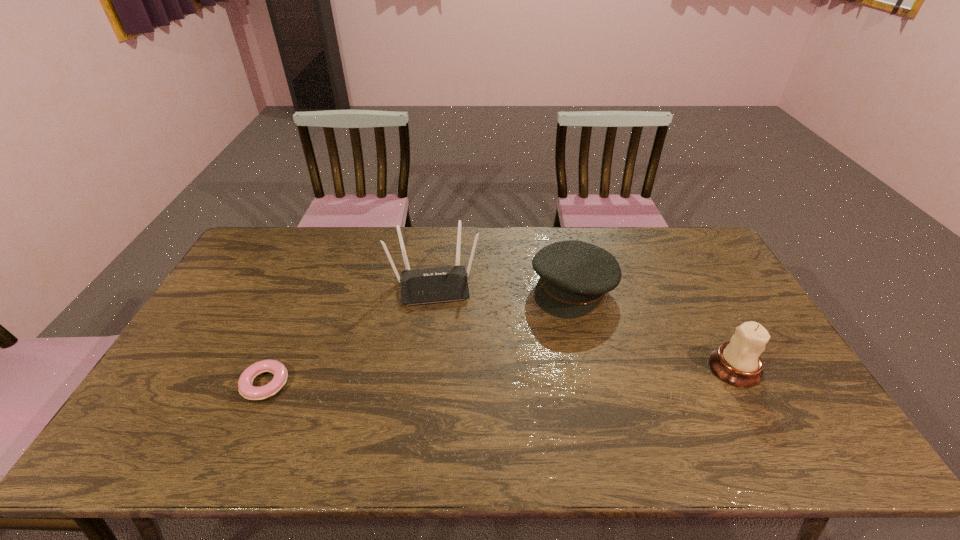
Identify the location of vacant space located on the front-facing side of the second object from right to left. (534, 332).

I want to click on free space located 0.370m on the front-facing side of the second object from left to right, so click(x=447, y=413).

The height and width of the screenshot is (540, 960). What are the coordinates of `vacant region located 0.210m on the front-facing side of the second object from left to right` in the screenshot? It's located at (443, 362).

Find the location of a particular element. This screenshot has width=960, height=540. blank space located 0.140m on the front-facing side of the second object from left to right is located at coordinates (441, 342).

You are a GUI agent. You are given a task and a screenshot of the screen. Output one action in this format:
    pyautogui.click(x=<x>, y=<y>)
    Task: Click on the beret present at the far edge
    This screenshot has height=540, width=960.
    Given the screenshot: What is the action you would take?
    pyautogui.click(x=574, y=275)

Locate an element on the screen. The height and width of the screenshot is (540, 960). router at the far edge is located at coordinates (430, 285).

I want to click on object present at the near edge, so click(246, 389).

What are the coordinates of `object at the right edge` in the screenshot? It's located at 738,362.

Where is `vacant space at the far edge of the desktop`? This screenshot has width=960, height=540. vacant space at the far edge of the desktop is located at coordinates (611, 238).

This screenshot has height=540, width=960. Identify the location of free region at the near edge of the desktop. (267, 399).